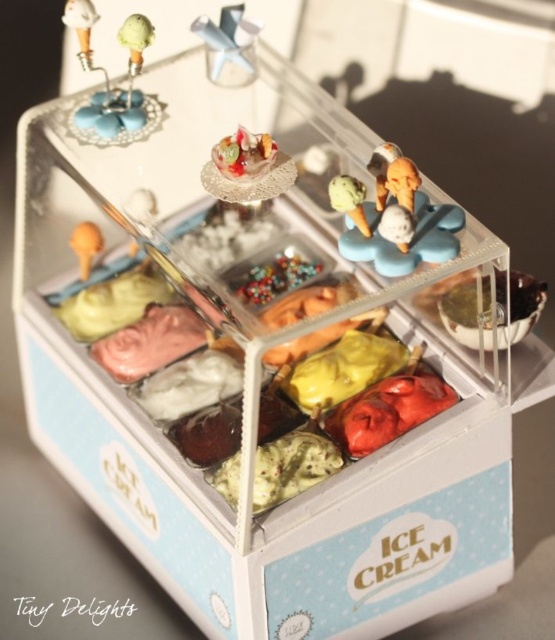
You are standing in front of the ice cream display case and want to reach the point closer to you. Which point should you aim for, point [377,218] or point [248,134]?

Point [377,218] is in front of point [248,134], so you should aim for point [377,218] as it is closer to you.

You are a customer at the ice cream shop and want to choose between the metallic silver spoon at upper center and the matte orange ice cream scoop at center. Which one is bigger?

The metallic silver spoon at upper center is larger in size than the matte orange ice cream scoop at center.

You are a customer at the ice cream shop and want to choose between the matte plastic ice cream cones at center and the translucent glass bowl at center. Which one is taller?

The matte plastic ice cream cones at center is taller than the translucent glass bowl at center.